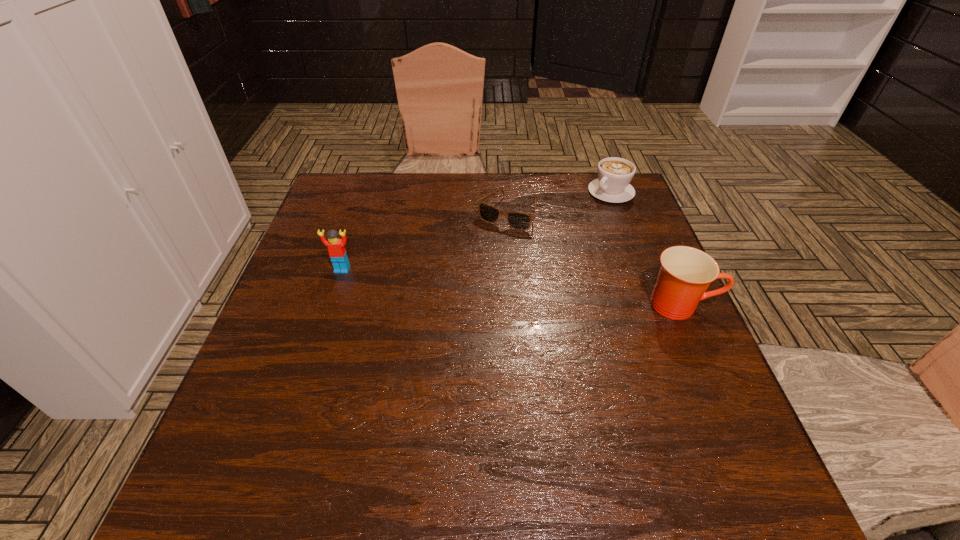
The height and width of the screenshot is (540, 960). I want to click on the leftmost object, so click(x=336, y=247).

This screenshot has height=540, width=960. What are the coordinates of `Lego` in the screenshot? It's located at (336, 247).

Find the location of a particular element. The height and width of the screenshot is (540, 960). cup is located at coordinates (686, 272).

The height and width of the screenshot is (540, 960). I want to click on sunglasses, so click(521, 221).

The image size is (960, 540). I want to click on the third object from right to left, so click(521, 221).

The width and height of the screenshot is (960, 540). In order to click on the third tallest object in this screenshot , I will do `click(614, 174)`.

Find the location of a particular element. vacant region located 0.140m on the face of the second nearest object is located at coordinates (326, 317).

This screenshot has width=960, height=540. I want to click on free location located 0.230m on the left of the cup, so click(545, 305).

Find the location of `free region located on the frames of the third object from right to left`. free region located on the frames of the third object from right to left is located at coordinates (479, 254).

The width and height of the screenshot is (960, 540). What are the coordinates of `vacant space positioned on the frames of the third object from right to left` in the screenshot? It's located at (439, 317).